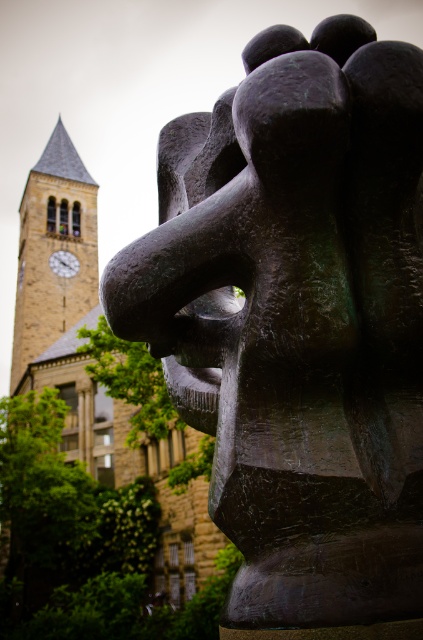
Does point (19, 266) come closer to viewer compared to point (58, 253)?

No, (19, 266) is behind (58, 253).

Can you confirm if brown stone clock tower at upper left is taller than wooden clock at upper left?

Yes.

Is point (19, 248) positioned behind point (60, 257)?

Yes, it is.

Find the location of a particular element. The image size is (423, 640). brown stone clock tower at upper left is located at coordinates (54, 250).

Which is behind, point (38, 234) or point (66, 257)?

Positioned behind is point (66, 257).

Which is above, brown stone church at center or wooden clock at upper left?

wooden clock at upper left is above.

From the picture: Who is more distant from viewer, (109, 451) or (57, 253)?

The point (57, 253) is more distant.

Identify the location of brown stone church at center. (95, 365).

Looking at this image, which of these two, brown stone church at center or brown stone clock tower at upper left, stands taller?

brown stone church at center is taller.

Is brown stone church at center to the left of brown stone clock tower at upper left from the viewer's perspective?

In fact, brown stone church at center is to the right of brown stone clock tower at upper left.

What do you see at coordinates (95, 365) in the screenshot? The image size is (423, 640). I see `brown stone church at center` at bounding box center [95, 365].

At what (x,y) coordinates should I click in order to perform the action: click on brown stone church at center. Please return your answer as a coordinate pair (x, y). This screenshot has width=423, height=640. Looking at the image, I should click on (95, 365).